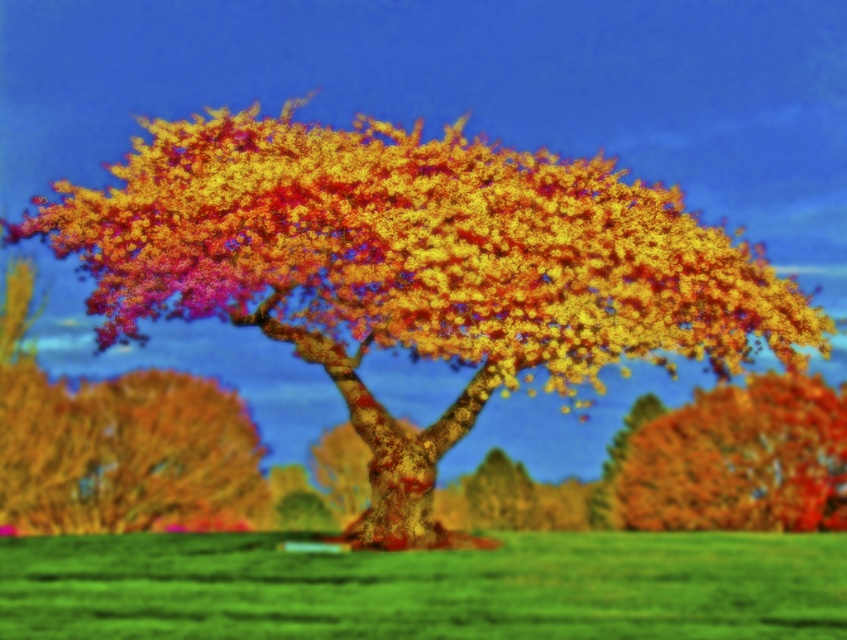
Question: Based on their relative distances, which object is farther from the multicolored bark tree at center?

Choices:
 (A) shiny multicolored leaves at center
 (B) autumn leaves at right

Answer: (A)

Question: Is multicolored bark tree at center smaller than shiny multicolored leaves at center?

Choices:
 (A) no
 (B) yes

Answer: (B)

Question: Considering the real-world distances, which object is farthest from the multicolored bark tree at center?

Choices:
 (A) shiny multicolored leaves at center
 (B) green grass at center
 (C) autumn leaves at right

Answer: (A)

Question: Is green grass at center above autumn leaves at right?

Choices:
 (A) yes
 (B) no

Answer: (B)

Question: Which object is farther from the camera taking this photo?

Choices:
 (A) autumn leaves at right
 (B) multicolored bark tree at center
 (C) shiny multicolored leaves at center

Answer: (A)

Question: Does shiny multicolored leaves at center appear under autumn leaves at right?

Choices:
 (A) no
 (B) yes

Answer: (A)